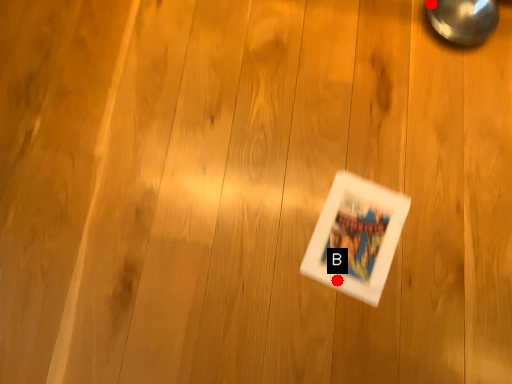
Question: Two points are circled on the image, labeled by A and B beside each circle. Which point appears closest to the camera in this image?

Choices:
 (A) A is closer
 (B) B is closer

Answer: (B)